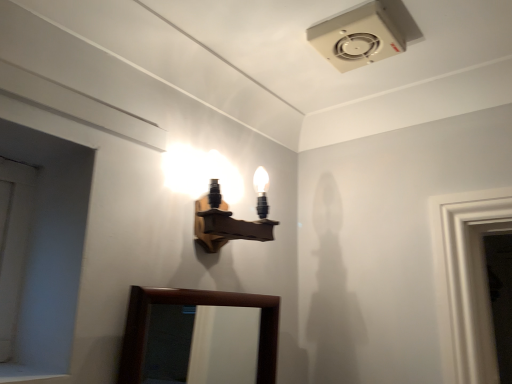
Question: Is wooden wall sconce at upper center spatially inside brown wooden mirror at lower center, or outside of it?

Choices:
 (A) outside
 (B) inside

Answer: (A)

Question: Visually, is wooden wall sconce at upper center positioned to the left or to the right of brown wooden mirror at lower center?

Choices:
 (A) left
 (B) right

Answer: (B)

Question: Estimate the real-world distances between objects in this image. Which object is farther from the white matte door at left?

Choices:
 (A) brown wooden mirror at lower center
 (B) wooden wall sconce at upper center

Answer: (A)

Question: Which object is positioned closest to the wooden wall sconce at upper center?

Choices:
 (A) brown wooden mirror at lower center
 (B) white matte door at left

Answer: (B)